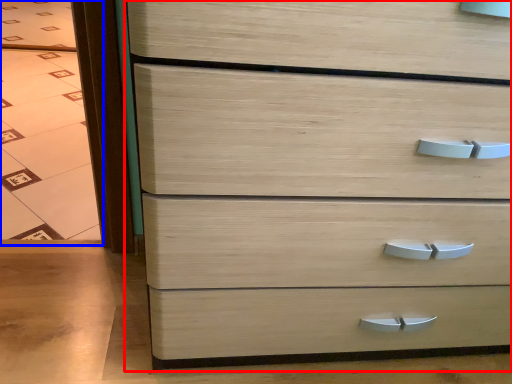
Question: Among these objects, which one is nearest to the camera, chest of drawers (highlighted by a red box) or glass door (highlighted by a blue box)?

Choices:
 (A) chest of drawers
 (B) glass door

Answer: (A)